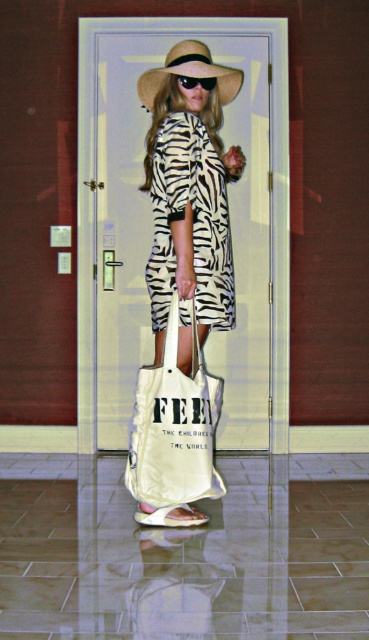
Does white matte bag at center have a smaller size compared to black plastic goggles at center?

Actually, white matte bag at center might be larger than black plastic goggles at center.

Is white matte bag at center behind black plastic goggles at center?

No, it is not.

Does point (153, 257) come farther from viewer compared to point (212, 83)?

That is False.

You are a GUI agent. You are given a task and a screenshot of the screen. Output one action in this format:
    pyautogui.click(x=<x>, y=<y>)
    Task: Click on the white matte bag at center
    Image resolution: width=369 pixels, height=640 pixels.
    Given the screenshot: What is the action you would take?
    pyautogui.click(x=188, y=195)

Between point (209, 314) and point (181, 84), which one is positioned in front?

Point (209, 314) is more forward.

Is zebra print fabric dress at center wider than black plastic goggles at center?

Indeed, zebra print fabric dress at center has a greater width compared to black plastic goggles at center.

Is point (159, 246) farther from camera compared to point (187, 77)?

No, it is in front of (187, 77).

The width and height of the screenshot is (369, 640). In order to click on zebra print fabric dress at center in this screenshot , I will do `click(192, 221)`.

Which is behind, point (167, 145) or point (194, 516)?

The point (194, 516) is behind.

Can you confirm if zebra print fabric dress at center is shorter than beige fabric sandal at lower center?

Incorrect, zebra print fabric dress at center's height does not fall short of beige fabric sandal at lower center's.

Which is in front, point (163, 278) or point (191, 522)?

Point (191, 522)

The height and width of the screenshot is (640, 369). Identify the location of zebra print fabric dress at center. (192, 221).